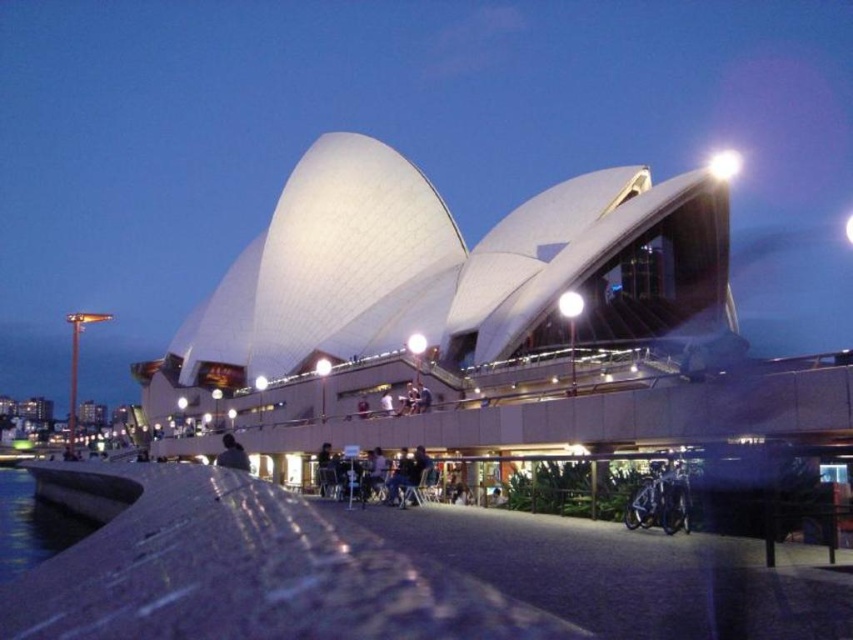
You are a photographer planning to capture the Sydney Opera House at dusk. You want to frame the scene such that the clear water at lower left and the light brown wooden chair at lower center are both visible. Which object should you position wider in your camera frame?

The clear water at lower left should be positioned wider in your camera frame because its width surpasses that of the light brown wooden chair at lower center.

You are planning to take a photo of the Sydney Opera House at dusk. You want to include both the clear water at lower left and the light brown wooden chair at lower center in your shot. Which object should you focus on first if you want to ensure both are in the frame?

Since the clear water at lower left is larger than the light brown wooden chair at lower center, you should focus on the clear water at lower left first to ensure it fits within the frame, then adjust to include the smaller chair.

You are standing at the Sydney Opera House walkway and want to reach a specific point marked at coordinates point (15,561). If your current position is 100 feet away from the Opera House, can you estimate whether the marked point is closer to you or further away than the Opera House itself?

The distance of point (15,561) from viewer is 277.00 feet. Since you are currently 100 feet away from the Opera House, the marked point is further away than the Opera House itself.